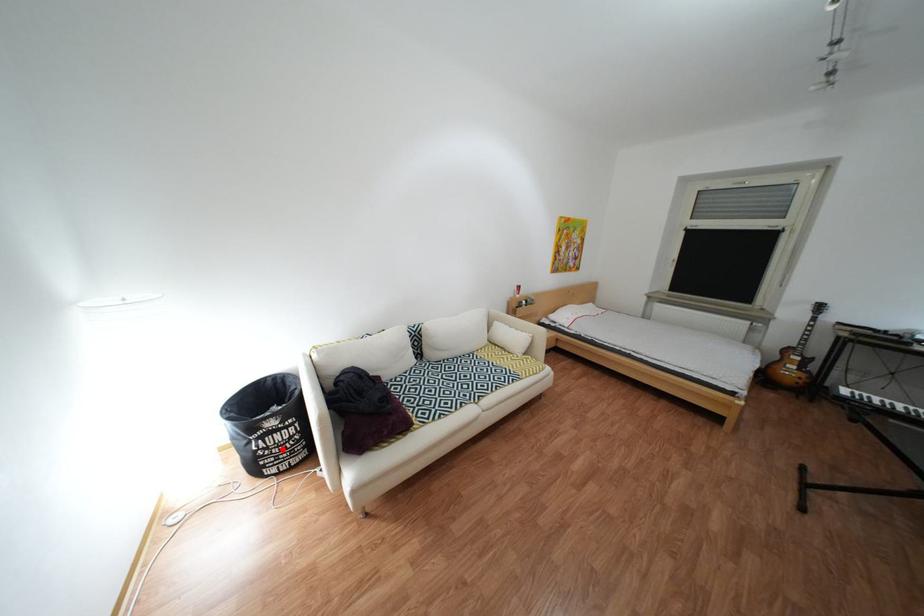
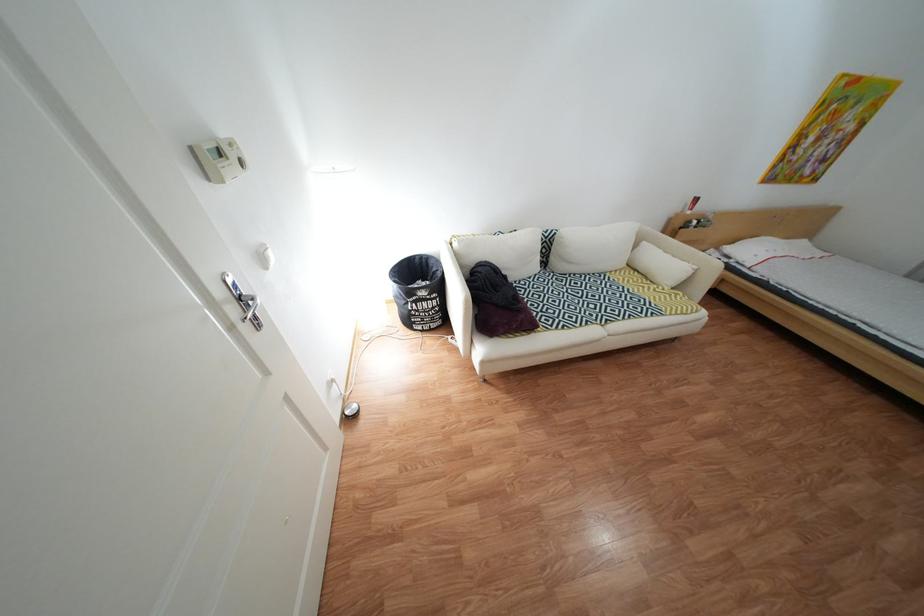
Question: A red point is marked in image1. In image2, is the corresponding 3D point closer to the camera or farther? Reply with the corresponding letter.

Choices:
 (A) The corresponding 3D point is closer.
 (B) The corresponding 3D point is farther.

Answer: (A)